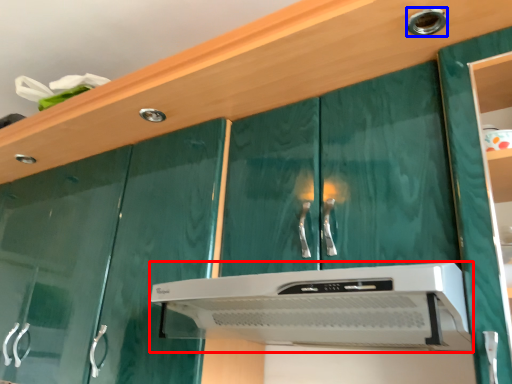
Question: Which point is further to the camera, home appliance (highlighted by a red box) or knob (highlighted by a blue box)?

Choices:
 (A) home appliance
 (B) knob

Answer: (B)